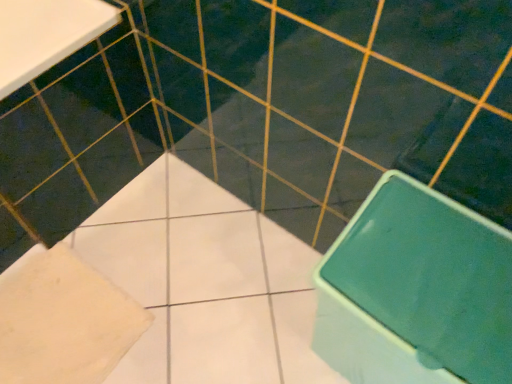
What do you see at coordinates (416, 291) in the screenshot? I see `teal glossy toilet at lower right` at bounding box center [416, 291].

Locate an element on the screen. The width and height of the screenshot is (512, 384). teal glossy toilet at lower right is located at coordinates (416, 291).

At what (x,y) coordinates should I click in order to perform the action: click on teal glossy toilet at lower right. Please return your answer as a coordinate pair (x, y). The height and width of the screenshot is (384, 512). Looking at the image, I should click on (416, 291).